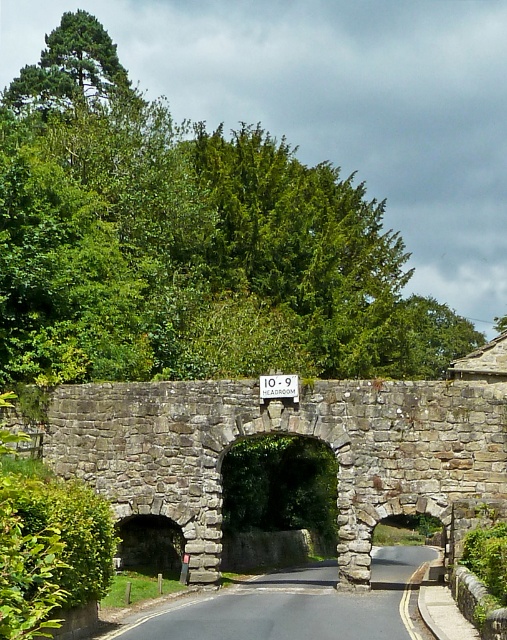
Is the position of green stone archway at center more distant than that of white plastic sign at center?

Yes, green stone archway at center is further from the viewer.

Is the position of green stone archway at center less distant than that of white plastic sign at center?

No, green stone archway at center is further to the viewer.

Is point (245, 448) positioned after point (286, 388)?

Yes.

The image size is (507, 640). I want to click on green stone archway at center, so click(277, 502).

Is stone archway at center thinner than green stone archway at center?

No, stone archway at center is not thinner than green stone archway at center.

This screenshot has height=640, width=507. Describe the element at coordinates (284, 433) in the screenshot. I see `stone archway at center` at that location.

Where is `stone archway at center`? stone archway at center is located at coordinates (284, 433).

Is point (167, 492) positioned after point (285, 381)?

Yes, point (167, 492) is farther from viewer.

Which is behind, point (342, 384) or point (285, 387)?

Point (342, 384)

Locate an element on the screen. stone archway at center is located at coordinates (284, 433).